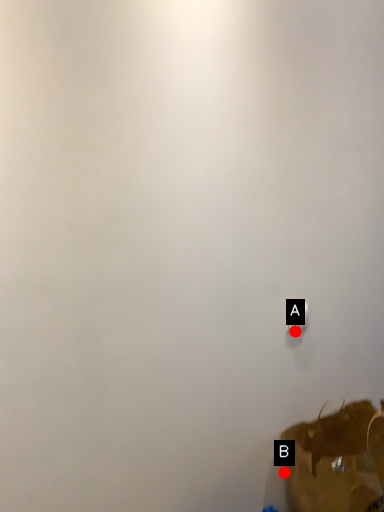
Question: Two points are circled on the image, labeled by A and B beside each circle. Which point is closer to the camera?

Choices:
 (A) A is closer
 (B) B is closer

Answer: (A)